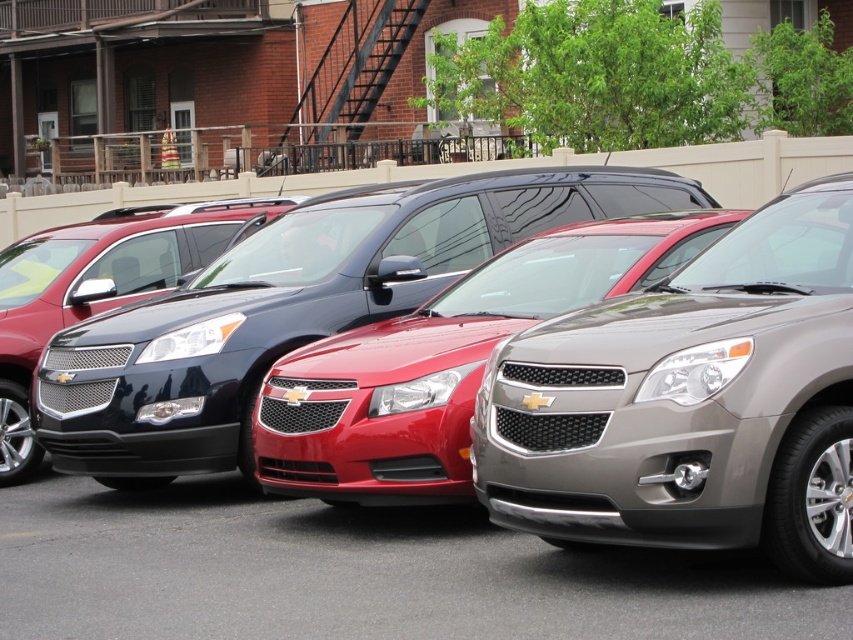
Does satin silver suv at center lie behind glossy black minivan at center?

No, it is in front of glossy black minivan at center.

Does point (809, 413) lie in front of point (331, 204)?

Yes, it is.

Locate an element on the screen. The image size is (853, 640). satin silver suv at center is located at coordinates (691, 401).

Find the location of `metallic red car at center`. metallic red car at center is located at coordinates (357, 573).

How distant is metallic red car at center from satin black suv at center?

metallic red car at center is 3.21 meters from satin black suv at center.

The width and height of the screenshot is (853, 640). What do you see at coordinates (357, 573) in the screenshot? I see `metallic red car at center` at bounding box center [357, 573].

The image size is (853, 640). I want to click on metallic red car at center, so [357, 573].

Consider the image. Is satin silver suv at center taller than metallic red car at center?

Indeed, satin silver suv at center has a greater height compared to metallic red car at center.

Is point (544, 444) farther from viewer compared to point (346, 586)?

No, it is in front of (346, 586).

Does point (637, 541) lie behind point (506, 612)?

No, (637, 541) is closer to viewer.

Where is `satin silver suv at center`? Image resolution: width=853 pixels, height=640 pixels. satin silver suv at center is located at coordinates (691, 401).